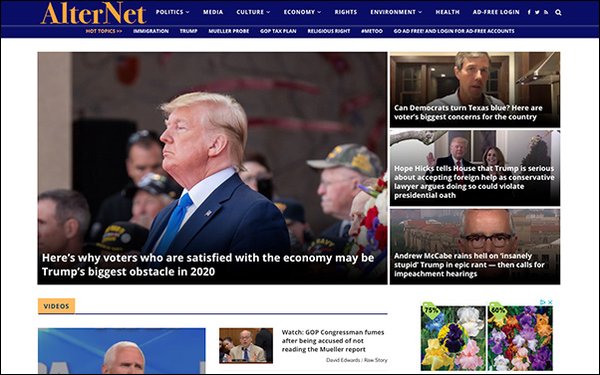
The width and height of the screenshot is (600, 375). What are the coordinates of `picture` in the screenshot? It's located at (162, 348), (225, 335), (307, 153), (478, 79), (515, 146), (514, 230), (505, 320), (459, 327).